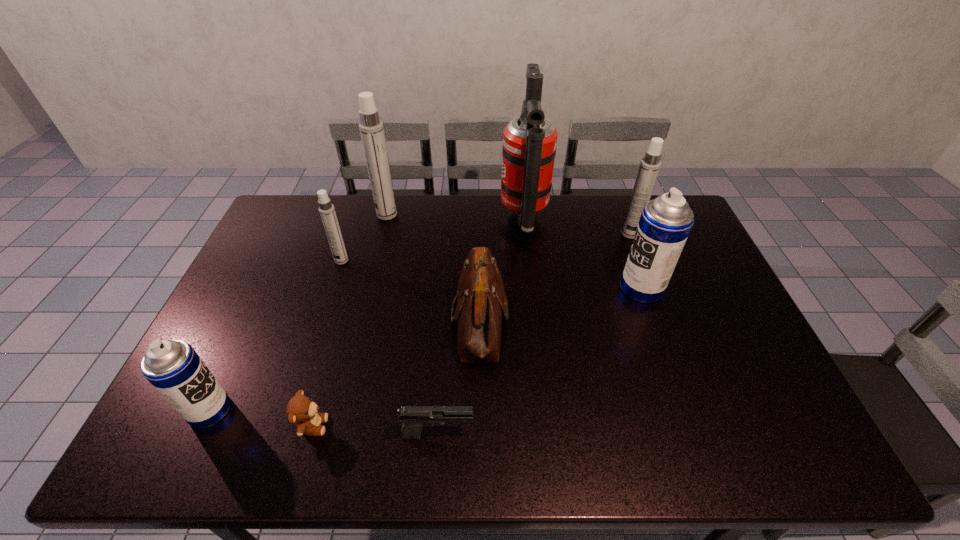
Locate an element on the screen. This screenshot has width=960, height=540. free point between the brown shoulder bag and the farthest aerosol can is located at coordinates (433, 267).

Identify the location of free space between the fourth farthest aerosol can and the nearest aerosol can. This screenshot has width=960, height=540. (425, 349).

The width and height of the screenshot is (960, 540). What are the coordinates of `free point between the teddy bear and the nearest white aerosol can` in the screenshot? It's located at (327, 343).

In order to click on unoccupied area between the red fire extinguisher and the third aerosol can from left to right in this screenshot , I will do `click(456, 216)`.

The image size is (960, 540). Identify the location of empty location between the red fire extinguisher and the rightmost white aerosol can. (577, 226).

Where is `the sixth closest object to the pistol`? the sixth closest object to the pistol is located at coordinates (529, 141).

Identify which object is the closest to the nearest aerosol can. Please provide its 2D coordinates. Your answer should be formatted as a tuple, i.e. [(x, y)], where the tuple contains the x and y coordinates of a point satisfying the conditions above.

[(301, 410)]

I want to click on aerosol can object that ranks as the second closest to the farthest white aerosol can, so click(x=173, y=367).

Locate which aerosol can ranks in proximity to the pistol. Please provide its 2D coordinates. Your answer should be formatted as a tuple, i.e. [(x, y)], where the tuple contains the x and y coordinates of a point satisfying the conditions above.

[(173, 367)]

Locate an element on the screen. white aerosol can object that ranks as the third closest to the shoulder bag is located at coordinates (649, 167).